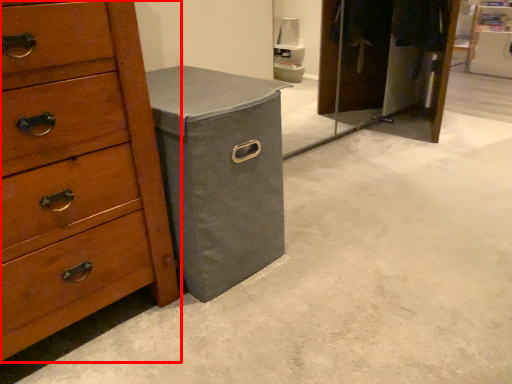
Question: Observing the image, what is the correct spatial positioning of chest of drawers (annotated by the red box) in reference to cabinetry?

Choices:
 (A) left
 (B) right

Answer: (A)